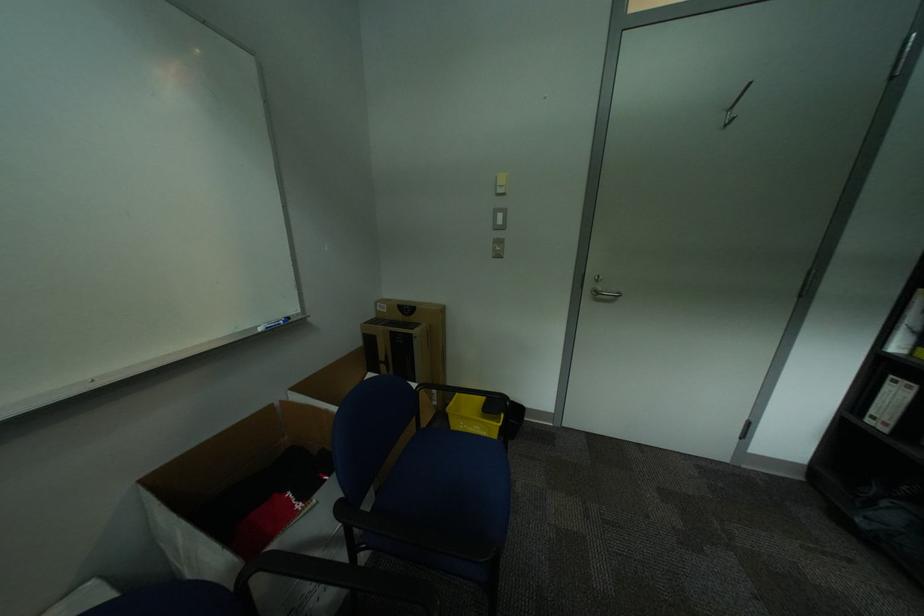
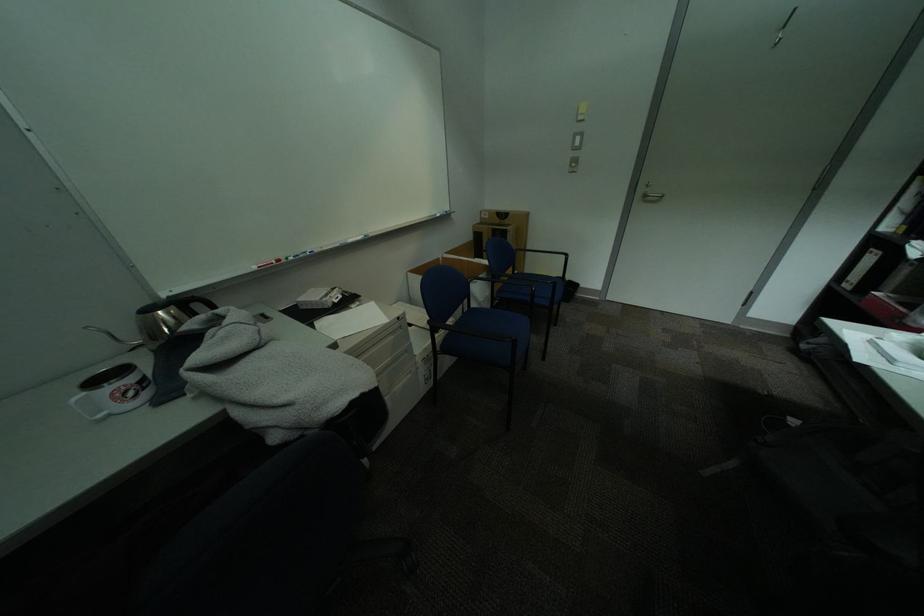
The point at (377, 323) is marked in the first image. Where is the corresponding point in the second image?

(487, 225)